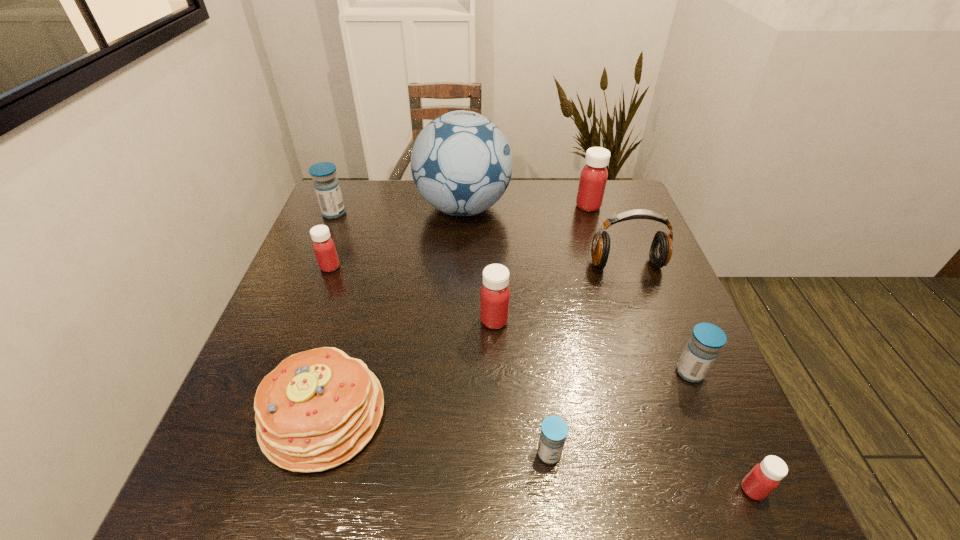
The height and width of the screenshot is (540, 960). What are the coordinates of `free space between the third medicine from right to left and the second nearest medicine` in the screenshot? It's located at (568, 330).

Where is `vacant space in between the fifth medicine from left to right and the nearest red medicine`? vacant space in between the fifth medicine from left to right and the nearest red medicine is located at coordinates 670,348.

Locate an element on the screen. The image size is (960, 540). the eighth closest object to the sixth farthest object is located at coordinates (766, 476).

Identify which object is the ninth nearest to the farthest blue medicine. Please provide its 2D coordinates. Your answer should be formatted as a tuple, i.e. [(x, y)], where the tuple contains the x and y coordinates of a point satisfying the conditions above.

[(766, 476)]

Select which medicine appears as the second closest to the biggest blue medicine. Please provide its 2D coordinates. Your answer should be formatted as a tuple, i.e. [(x, y)], where the tuple contains the x and y coordinates of a point satisfying the conditions above.

[(495, 293)]

Where is `the third closest medicine to the tallest object`? the third closest medicine to the tallest object is located at coordinates (327, 188).

Locate an element on the screen. This screenshot has width=960, height=540. red medicine object that ranks as the second closest to the sixth farthest object is located at coordinates (593, 178).

At what (x,y) coordinates should I click in order to perform the action: click on red medicine that is the third closest to the second farthest red medicine. Please return your answer as a coordinate pair (x, y). This screenshot has height=540, width=960. Looking at the image, I should click on (766, 476).

Find the location of `blue medicine identified as the closest to the rightmost red medicine`. blue medicine identified as the closest to the rightmost red medicine is located at coordinates (707, 339).

Identify which blue medicine is the second nearest to the biggest blue medicine. Please provide its 2D coordinates. Your answer should be formatted as a tuple, i.e. [(x, y)], where the tuple contains the x and y coordinates of a point satisfying the conditions above.

[(707, 339)]